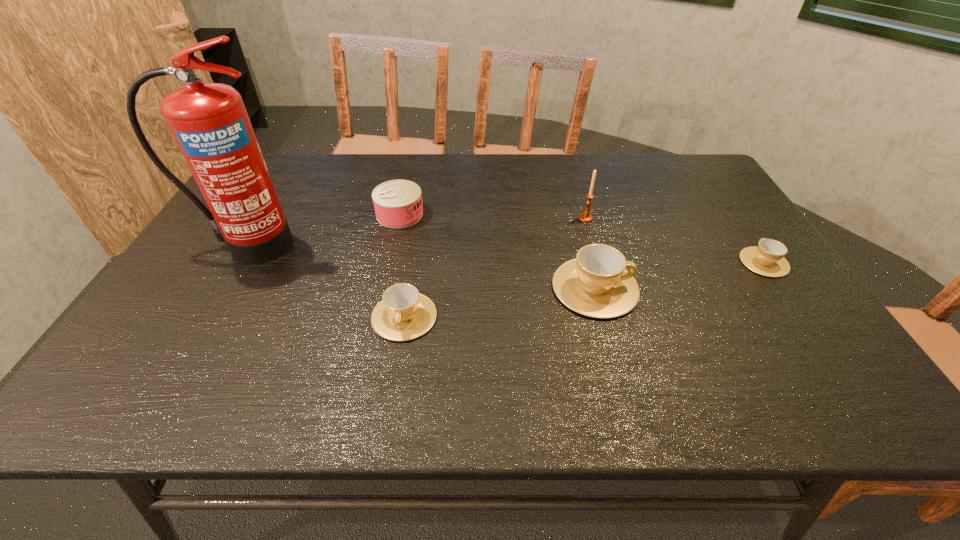
Where is `vacant region located with the handle on the side of the shortest object`? The width and height of the screenshot is (960, 540). vacant region located with the handle on the side of the shortest object is located at coordinates (703, 174).

Where is `vacant area located with the handle on the side of the shortest object`? The width and height of the screenshot is (960, 540). vacant area located with the handle on the side of the shortest object is located at coordinates (708, 180).

Find the location of a particular element. The width and height of the screenshot is (960, 540). free region located 0.270m with the handle on the side of the shortest object is located at coordinates (715, 192).

Where is `vacant space positioned on the surface of the leftmost object`? The image size is (960, 540). vacant space positioned on the surface of the leftmost object is located at coordinates (197, 334).

You are a GUI agent. You are given a task and a screenshot of the screen. Output one action in this format:
    pyautogui.click(x=<x>, y=<y>)
    Task: Click on the free region located on the left of the can
    The image size is (960, 540).
    Given the screenshot: What is the action you would take?
    pyautogui.click(x=254, y=214)

This screenshot has width=960, height=540. I want to click on vacant space situated on the left of the second tallest object, so click(443, 218).

Locate an element on the screen. The height and width of the screenshot is (540, 960). object present at the near edge is located at coordinates (403, 314).

Locate an element on the screen. This screenshot has height=540, width=960. object that is at the left edge is located at coordinates (209, 122).

Identify the location of object at the right edge. This screenshot has width=960, height=540. (767, 259).

This screenshot has width=960, height=540. I want to click on free region at the far edge, so click(657, 187).